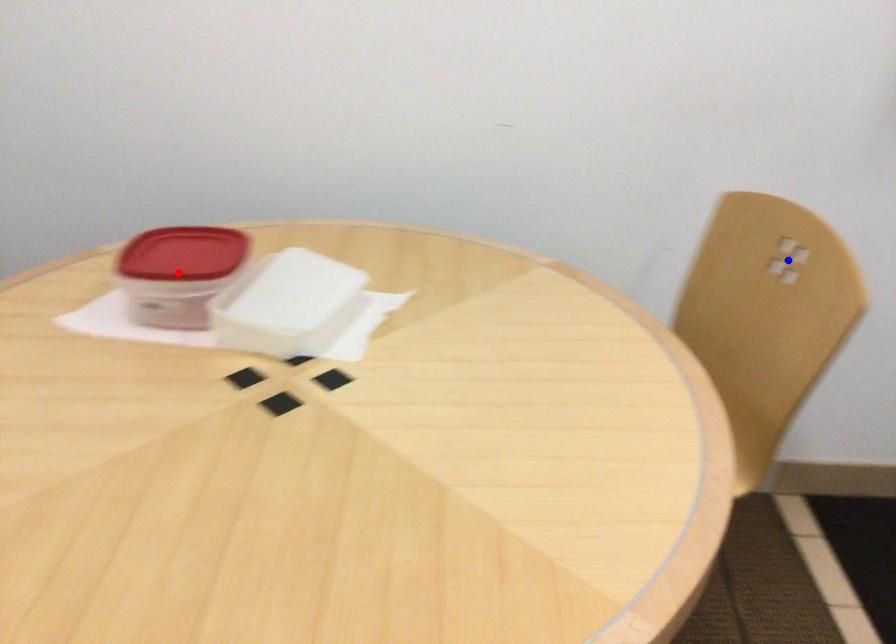
Question: Which of the two points in the image is closer to the camera?

Choices:
 (A) Blue point is closer.
 (B) Red point is closer.

Answer: (B)